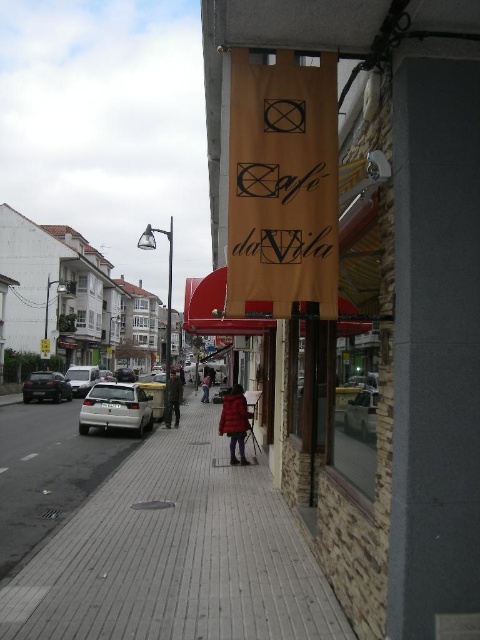
Does smooth concrete pavement at center appear on the left side of metallic silver car at center?

Indeed, smooth concrete pavement at center is positioned on the left side of metallic silver car at center.

Who is positioned more to the left, smooth concrete pavement at center or metallic silver car at center?

smooth concrete pavement at center is more to the left.

Is point (213, 476) positioned after point (368, 426)?

Yes, point (213, 476) is farther from viewer.

In order to click on smooth concrete pavement at center in this screenshot , I will do `click(176, 554)`.

Is orange fabric sign at upper center taller than red wool coat at center?

Yes.

The width and height of the screenshot is (480, 640). What are the coordinates of `orange fabric sign at upper center` in the screenshot? It's located at (382, 304).

Is point (427, 344) closer to viewer compared to point (206, 381)?

Yes, point (427, 344) is closer to viewer.

The width and height of the screenshot is (480, 640). In order to click on orange fabric sign at upper center in this screenshot , I will do `click(382, 304)`.

Does smooth concrete pavement at center have a lesser width compared to red wool coat at center?

In fact, smooth concrete pavement at center might be wider than red wool coat at center.

What do you see at coordinates (176, 554) in the screenshot? The height and width of the screenshot is (640, 480). I see `smooth concrete pavement at center` at bounding box center [176, 554].

Who is more distant from viewer, (249, 627) or (205, 380)?

Point (205, 380)

You are a GUI agent. You are given a task and a screenshot of the screen. Output one action in this format:
    pyautogui.click(x=<x>, y=<y>)
    Task: Click on the smooth concrete pavement at center
    The width and height of the screenshot is (480, 640).
    Given the screenshot: What is the action you would take?
    pyautogui.click(x=176, y=554)